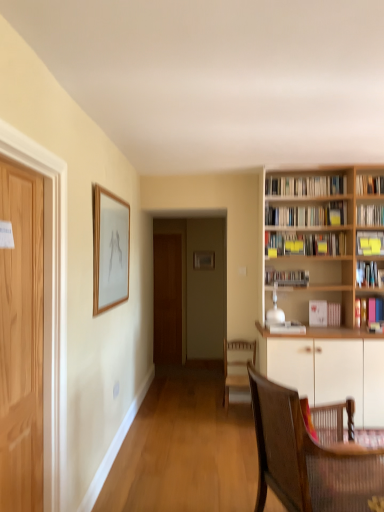
Question: Is white matte cabinet at right spatially inside wooden bookcase at right, or outside of it?

Choices:
 (A) outside
 (B) inside

Answer: (A)

Question: From a real-world perspective, relative to wooden bookcase at right, is white matte cabinet at right vertically above or below?

Choices:
 (A) above
 (B) below

Answer: (B)

Question: Which object is the farthest from the brown woven chair at lower right, the 2th chair from the back?

Choices:
 (A) wooden bookcase at right
 (B) wooden chair at center, which is counted as the 1th chair, starting from the back
 (C) matte black bookshelf at center, which is the 6th book from top to bottom
 (D) yellow paper-covered book at center, placed as the 4th book when sorted from top to bottom
 (E) light brown wooden door at left, which ranks as the first door in front-to-back order

Answer: (D)

Question: Which object is the closest to the yellow paper-covered book at center, placed as the 4th book when sorted from top to bottom?

Choices:
 (A) yellow sticky notes at upper right, positioned as the fifth book in bottom-to-top order
 (B) wooden chair at center, which is counted as the 1th chair, starting from the back
 (C) hardcover book at upper right, the 9th book from the bottom
 (D) brown wooden door at center, the second door when ordered from front to back
 (E) white paper book at right, arranged as the second book when ordered from the bottom

Answer: (A)